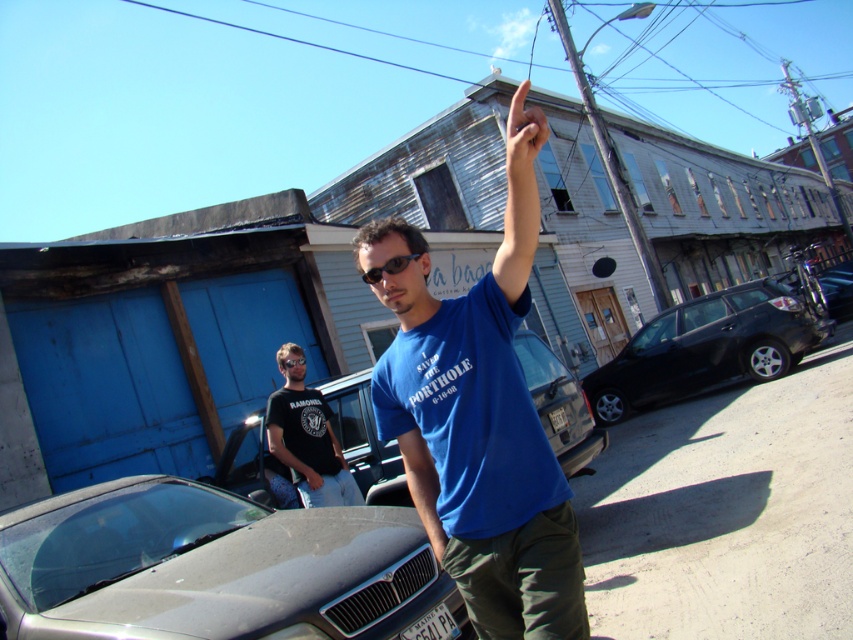
What are the coordinates of the blue cotton shirt at center in the image?

The blue cotton shirt at center is located at point coordinates (477, 433).